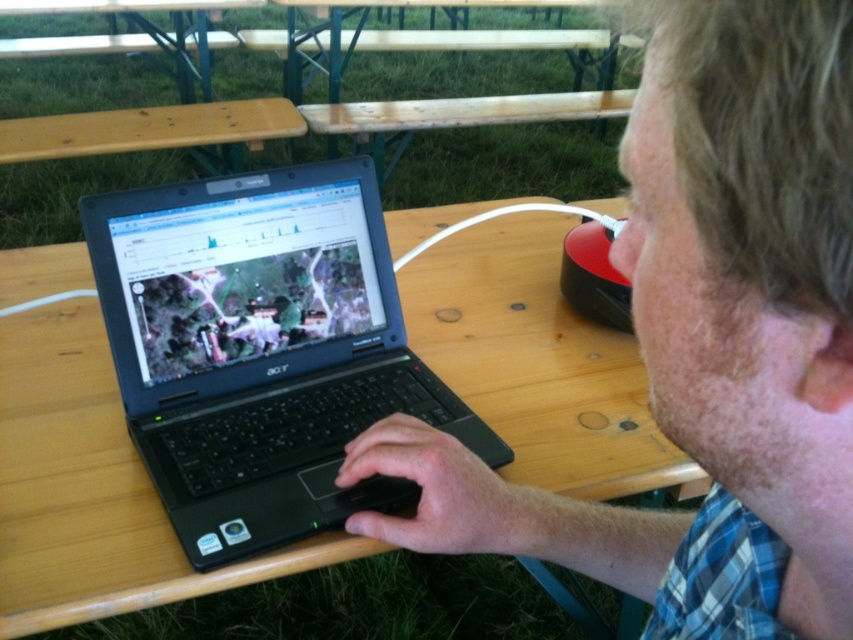
Looking at this image, you are standing at the picnic table where the person is working. You need to place a small item at point A and point B. The coordinates for point A are point A at (722, 621) and point B are point B at (283, 298). If you want to place the item closer to the person, which point should you choose?

Point A at (722, 621) is in front of point B at (283, 298), so placing the item at point A would be closer to the person.

You are a delivery person who needs to place a 10 inch wide package between the plaid shirt at center and the black matte laptop at center. Can you fit it there?

The plaid shirt at center is 8.73 inches from the black matte laptop at center. Since the package is 10 inches wide, which is wider than the available space, it cannot fit between them.

You are a photographer standing 10 inches away from the plaid shirt at center. You want to take a closeup photo of it without moving the shirt. Is your current distance sufficient?

The plaid shirt at center is 7.52 inches away from the viewer. Since you are standing 10 inches away, you are farther than the shirt, so you need to move closer to achieve a closeup photo.